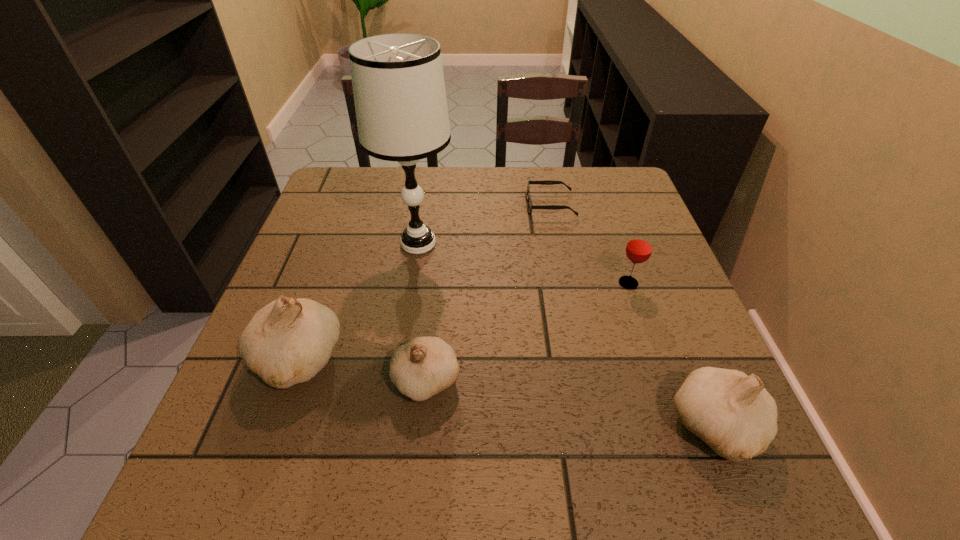
Identify the location of vacant space located 0.210m on the left of the second garlic from left to right. (279, 381).

Identify the location of free space located at the front lenses of the sunglasses. (485, 205).

The width and height of the screenshot is (960, 540). What are the coordinates of `vacant space situated 0.130m at the front lenses of the sunglasses` in the screenshot? It's located at (481, 205).

Locate an element on the screen. This screenshot has width=960, height=540. free spot located 0.350m at the front lenses of the sunglasses is located at coordinates (402, 205).

I want to click on vacant space located 0.110m on the right of the tallest object, so click(x=499, y=244).

This screenshot has width=960, height=540. Find the location of `free region located 0.270m on the front of the glass`. free region located 0.270m on the front of the glass is located at coordinates (668, 399).

At what (x,y) coordinates should I click in order to perform the action: click on object present at the far edge. Please return your answer as a coordinate pair (x, y). This screenshot has height=540, width=960. Looking at the image, I should click on (546, 182).

Find the location of a particular element. This screenshot has height=540, width=960. object at the left edge is located at coordinates (287, 342).

Where is `garlic situated at the right edge`? garlic situated at the right edge is located at coordinates (733, 413).

Image resolution: width=960 pixels, height=540 pixels. What are the coordinates of `glass that is at the right edge` in the screenshot? It's located at (639, 247).